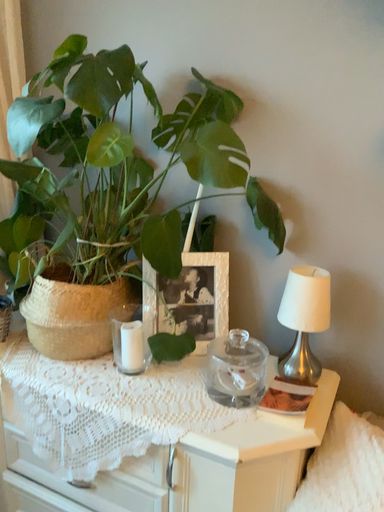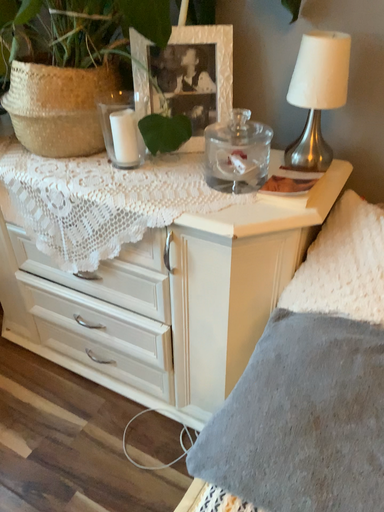
Question: Which way did the camera rotate in the video?

Choices:
 (A) rotated downward
 (B) rotated upward

Answer: (A)